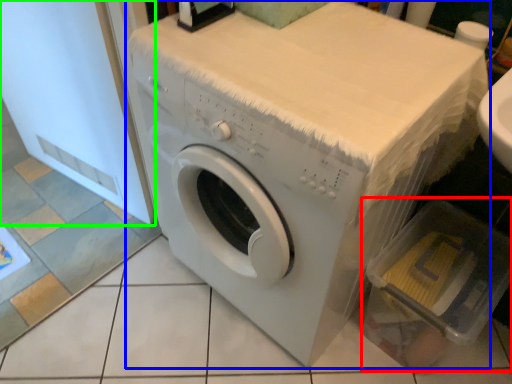
Question: Estimate the real-world distances between objects in this image. Which object is closer to dish washer (highlighted by a red box), washing machine (highlighted by a blue box) or screen door (highlighted by a green box)?

Choices:
 (A) washing machine
 (B) screen door

Answer: (A)